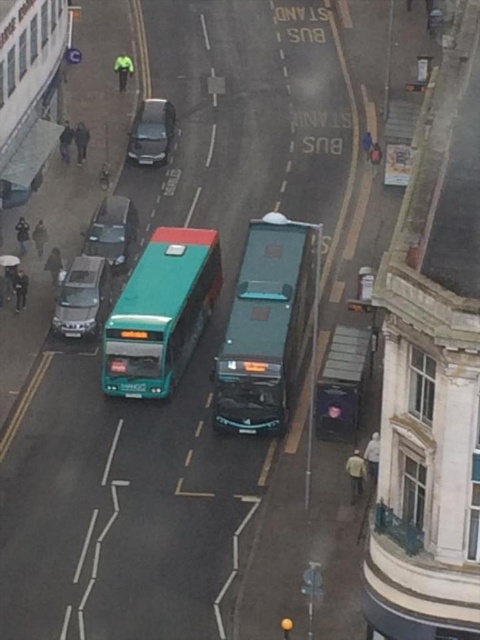
You are a delivery driver who needs to park your truck between the green matte bus at center and the teal matte bus at center. Your truck is 3 meters wide. Can you fit your truck between them?

The green matte bus at center is narrower than the teal matte bus at center. However, without knowing the exact distance between them, it is impossible to determine if the truck can fit. Please check the actual space available.

You are a delivery driver who needs to park your vehicle in this street scene. You have a truck that is 2 meters wide. The satin silver suv at left and metallic gray car at center are parked in the same lane. Can your truck fit between them if you position it directly between them?

The satin silver suv at left is wider than the metallic gray car at center. Since the satin silver suv at left is wider, the space between them may not be sufficient for a 2 meter wide truck. You should check the exact distance before attempting to park.

You are a delivery driver who needs to park your vehicle between the satin silver suv at left and the metallic gray car at center. Can you fit your 2.5 meter wide delivery van in the space between them?

The satin silver suv at left is positioned on the left side of metallic gray car at center. Since the distance between them isn not specified, it is impossible to determine if the 2.5 meter wide delivery van can fit. Please check the actual space available.